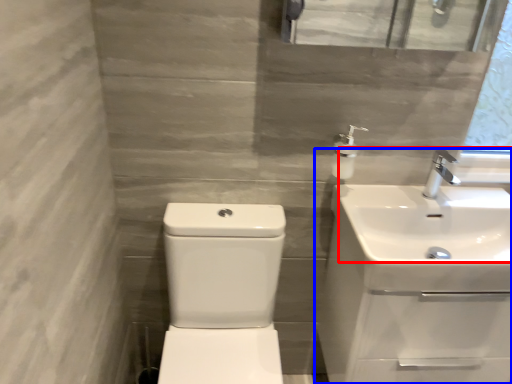
Question: Among these objects, which one is farthest to the camera, sink (highlighted by a red box) or sink (highlighted by a blue box)?

Choices:
 (A) sink
 (B) sink

Answer: (B)